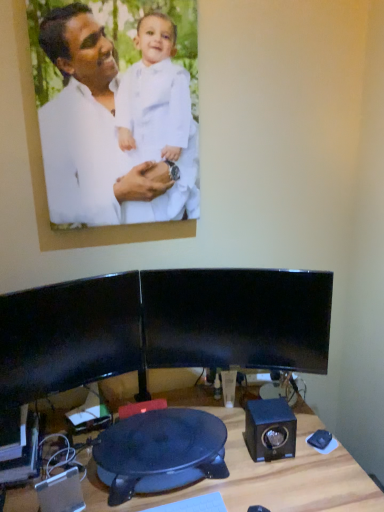
Where is `free space to the left of blue matte speaker at lower right, which appears as the 2th speaker when viewed from the front`? free space to the left of blue matte speaker at lower right, which appears as the 2th speaker when viewed from the front is located at coordinates coord(228,459).